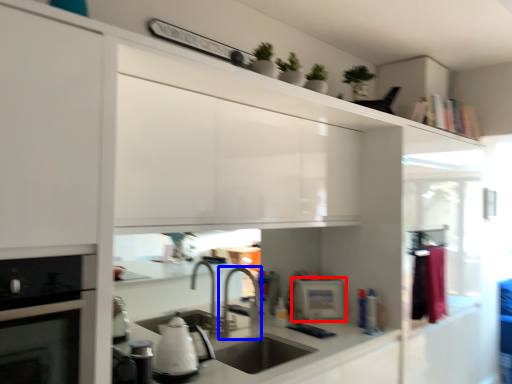
Question: Which of the following is the closest to the observer, appliance (highlighted by a red box) or tap (highlighted by a blue box)?

Choices:
 (A) appliance
 (B) tap

Answer: (B)